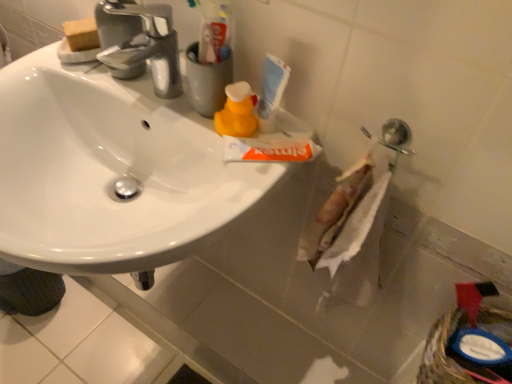
Question: From a real-world perspective, is chrome metallic faucet at upper left above or below white plastic toothpaste tube at upper center?

Choices:
 (A) below
 (B) above

Answer: (B)

Question: From the image's perspective, is chrome metallic faucet at upper left above or below white plastic toothpaste tube at upper center?

Choices:
 (A) below
 (B) above

Answer: (B)

Question: Which is nearer to the white glossy sink at upper left?

Choices:
 (A) chrome metallic faucet at upper left
 (B) blue plastic basket at lower right
 (C) white plastic toothpaste tube at upper center
 (D) yellow matte bottle at center

Answer: (A)

Question: Considering the real-world distances, which object is farthest from the chrome metallic faucet at upper left?

Choices:
 (A) yellow matte bottle at center
 (B) blue plastic basket at lower right
 (C) white glossy sink at upper left
 (D) white plastic toothpaste tube at upper center

Answer: (B)